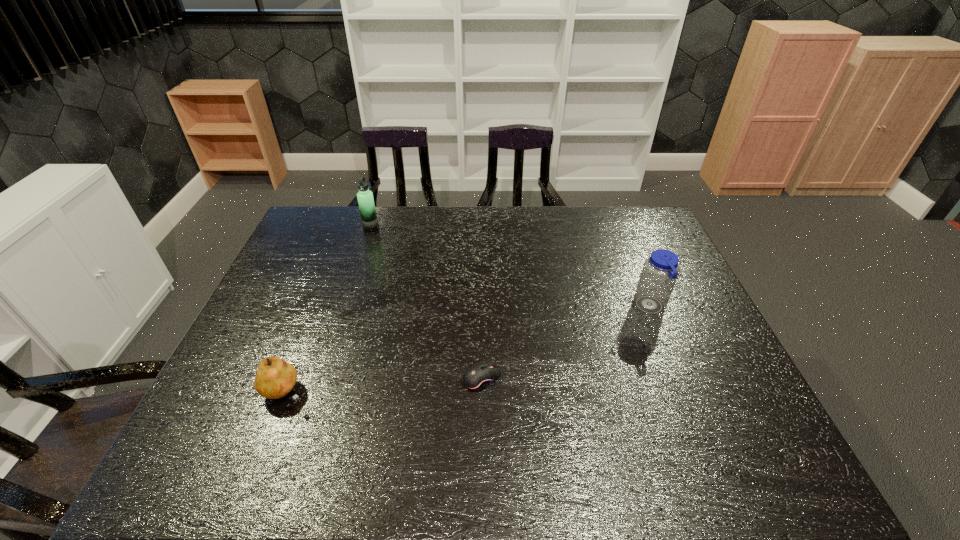
You are a GUI agent. You are given a task and a screenshot of the screen. Output one action in this format:
    pyautogui.click(x=<x>, y=<y>)
    Task: Click on the vacant space in between the pear and the second object from right to left
    This screenshot has height=540, width=960.
    Given the screenshot: What is the action you would take?
    pyautogui.click(x=383, y=385)

The height and width of the screenshot is (540, 960). What are the coordinates of `free area in between the pear and the thermos bottle` in the screenshot? It's located at (328, 310).

Identify the location of vacant space that's between the water bottle and the computer mouse. This screenshot has width=960, height=540. (565, 343).

Where is `vacant area that lies between the thermos bottle and the second shortest object`? This screenshot has height=540, width=960. vacant area that lies between the thermos bottle and the second shortest object is located at coordinates (328, 310).

The image size is (960, 540). In order to click on empty space between the pear and the rightmost object in this screenshot , I will do `click(468, 350)`.

Find the location of a particular element. The height and width of the screenshot is (540, 960). unoccupied area between the rightmost object and the farthest object is located at coordinates (511, 267).

Image resolution: width=960 pixels, height=540 pixels. In order to click on free space between the third nearest object and the computer mouse in this screenshot , I will do `click(565, 343)`.

Locate an element on the screen. The width and height of the screenshot is (960, 540). empty location between the second object from right to left and the second shortest object is located at coordinates (383, 385).

Where is `free area in between the water bottle and the computer mouse`? Image resolution: width=960 pixels, height=540 pixels. free area in between the water bottle and the computer mouse is located at coordinates (565, 343).

The image size is (960, 540). In order to click on free space between the thermos bottle and the pear in this screenshot , I will do `click(328, 310)`.